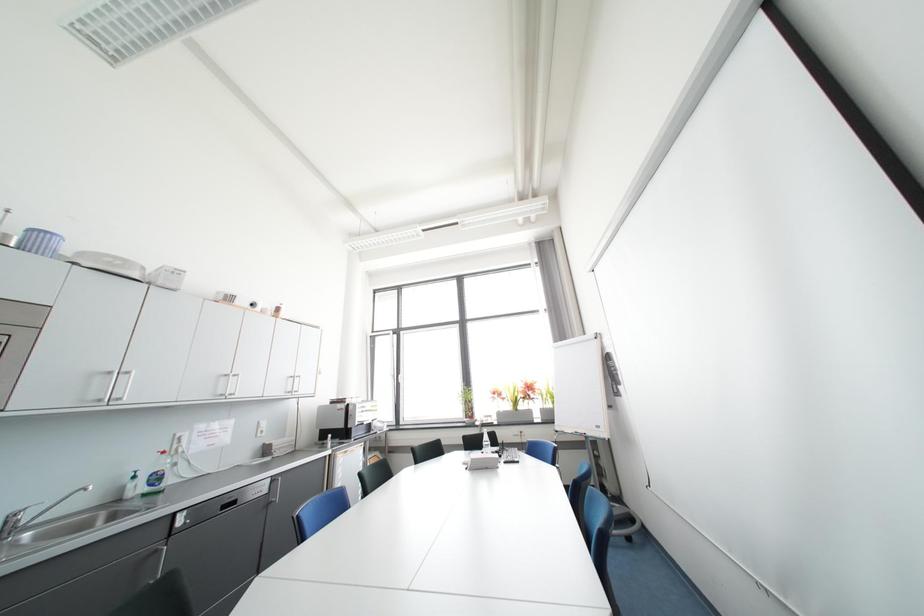
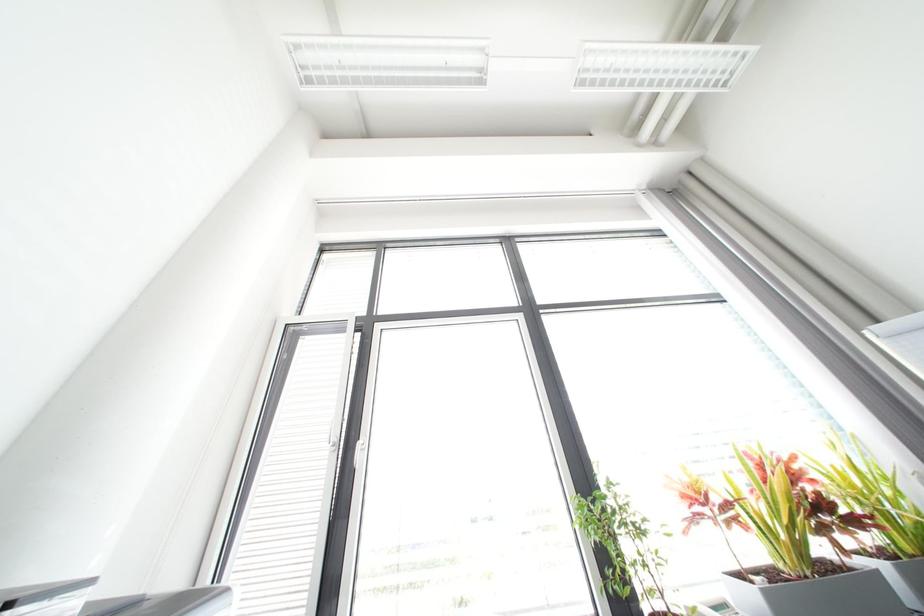
Question: Which direction would the cameraman need to move to produce the second image? Reply with the corresponding letter.

Choices:
 (A) Left
 (B) Right
 (C) Forward
 (D) Backward

Answer: (C)